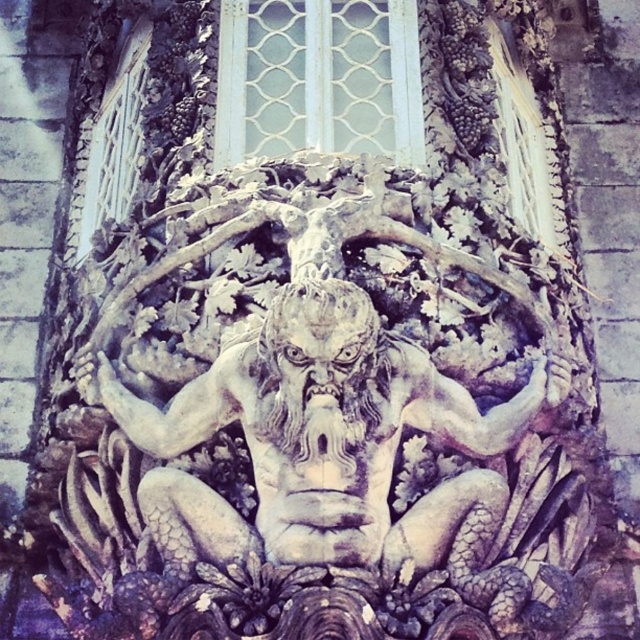
Question: Is white glass window at upper center wider than clear glass window at upper left?

Choices:
 (A) no
 (B) yes

Answer: (B)

Question: Does stone textured gargoyle at center lie in front of white glass window at upper center?

Choices:
 (A) no
 (B) yes

Answer: (B)

Question: Which point appears closest to the camera in this image?

Choices:
 (A) (316, 394)
 (B) (266, 76)
 (C) (497, 72)

Answer: (A)

Question: Among these points, which one is nearest to the camera?

Choices:
 (A) (474, 435)
 (B) (508, 202)
 (C) (273, 106)

Answer: (A)

Question: Can you confirm if stone textured gargoyle at center is thinner than clear glass window at upper center?

Choices:
 (A) yes
 (B) no

Answer: (B)

Question: Which object is closer to the camera taking this photo?

Choices:
 (A) stone textured gargoyle at center
 (B) clear glass window at upper left
 (C) clear glass window at upper center

Answer: (A)